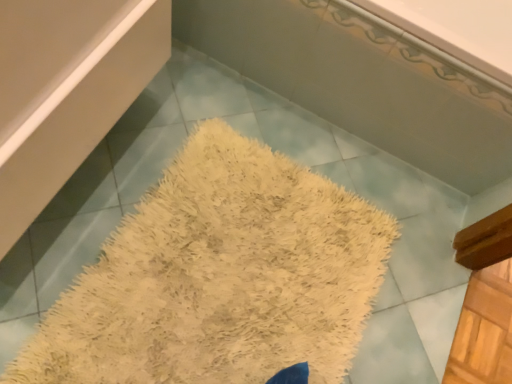
Question: From the image's perspective, is white fluffy bath mat at center positioned above or below white shaggy rug at center?

Choices:
 (A) above
 (B) below

Answer: (B)

Question: Considering the positions of white fluffy bath mat at center and white shaggy rug at center in the image, is white fluffy bath mat at center taller or shorter than white shaggy rug at center?

Choices:
 (A) tall
 (B) short

Answer: (B)

Question: Is white fluffy bath mat at center spatially inside white shaggy rug at center, or outside of it?

Choices:
 (A) inside
 (B) outside

Answer: (B)

Question: From a real-world perspective, relative to white fluffy bath mat at center, is white shaggy rug at center vertically above or below?

Choices:
 (A) below
 (B) above

Answer: (B)

Question: Looking at the image, does white shaggy rug at center seem bigger or smaller compared to white fluffy bath mat at center?

Choices:
 (A) small
 (B) big

Answer: (B)

Question: From the image's perspective, is white shaggy rug at center located above or below white fluffy bath mat at center?

Choices:
 (A) above
 (B) below

Answer: (A)

Question: Considering the relative positions of white shaggy rug at center and white fluffy bath mat at center in the image provided, is white shaggy rug at center to the left or to the right of white fluffy bath mat at center?

Choices:
 (A) right
 (B) left

Answer: (A)